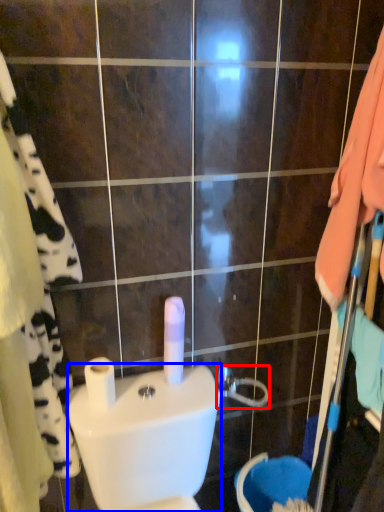
Question: Among these objects, which one is nearest to the camera, shower (highlighted by a red box) or toilet bowl (highlighted by a blue box)?

Choices:
 (A) shower
 (B) toilet bowl

Answer: (B)